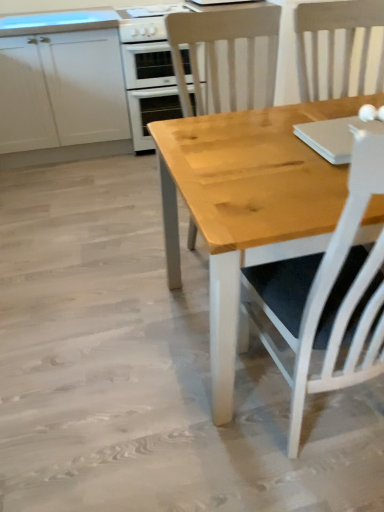
Question: Does point (162, 27) appear closer or farther from the camera than point (66, 39)?

Choices:
 (A) closer
 (B) farther

Answer: (B)

Question: From a real-world perspective, relative to white matte cabinet at upper left, is white glossy gas stove at upper center vertically above or below?

Choices:
 (A) above
 (B) below

Answer: (A)

Question: Estimate the real-world distances between objects in this image. Which object is closer to the white glossy oven at upper left?

Choices:
 (A) white matte cabinet at upper left
 (B) wooden chair at center
 (C) white glossy gas stove at upper center

Answer: (C)

Question: Based on their relative distances, which object is nearer to the white matte cabinet at upper left?

Choices:
 (A) wooden chair at center
 (B) white glossy oven at upper left
 (C) white glossy gas stove at upper center

Answer: (B)